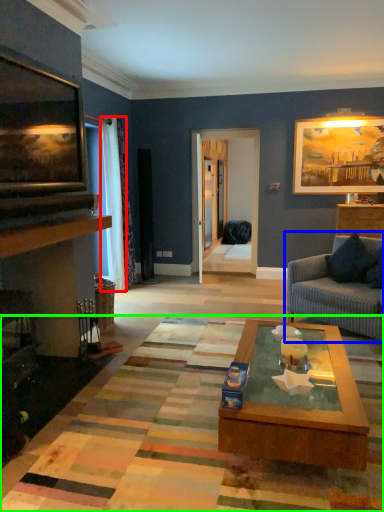
Question: Estimate the real-world distances between objects in this image. Which object is closer to curtain (highlighted by a red box), studio couch (highlighted by a blue box) or mat (highlighted by a green box)?

Choices:
 (A) studio couch
 (B) mat

Answer: (A)